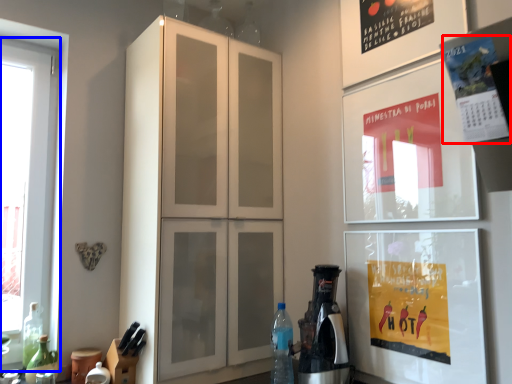
Question: Among these objects, which one is farthest to the camera, poster (highlighted by a red box) or window (highlighted by a blue box)?

Choices:
 (A) poster
 (B) window

Answer: (B)